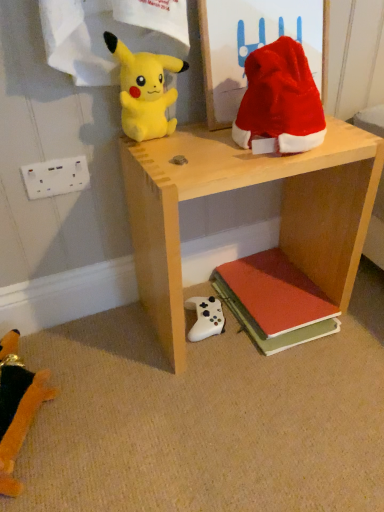
The width and height of the screenshot is (384, 512). In order to click on free space in front of white matte game controller at lower center, placed as the third toy when sorted from top to bottom in this screenshot , I will do 215,370.